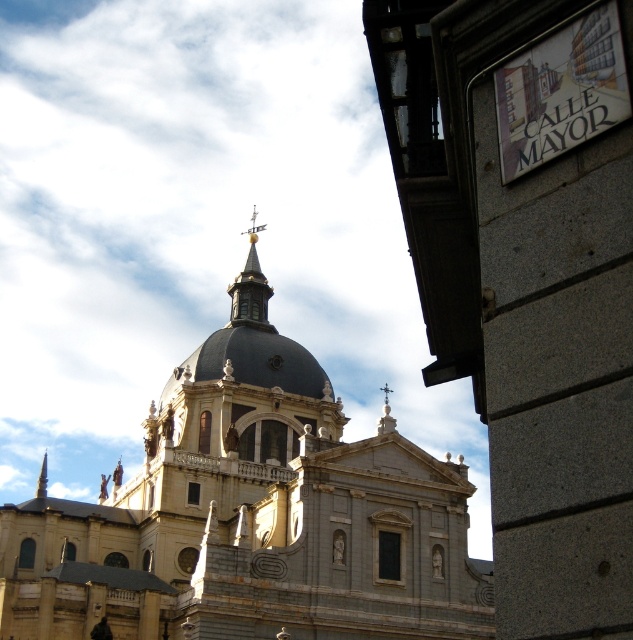
Between gray stone church at center and gold-bronze spire at upper center, which one appears on the left side from the viewer's perspective?

Positioned to the left is gray stone church at center.

Who is lower down, gray stone church at center or gold-bronze spire at upper center?

gray stone church at center is below.

In order to click on gray stone church at center in this screenshot , I will do `click(251, 520)`.

Where is `gray stone church at center`? gray stone church at center is located at coordinates (251, 520).